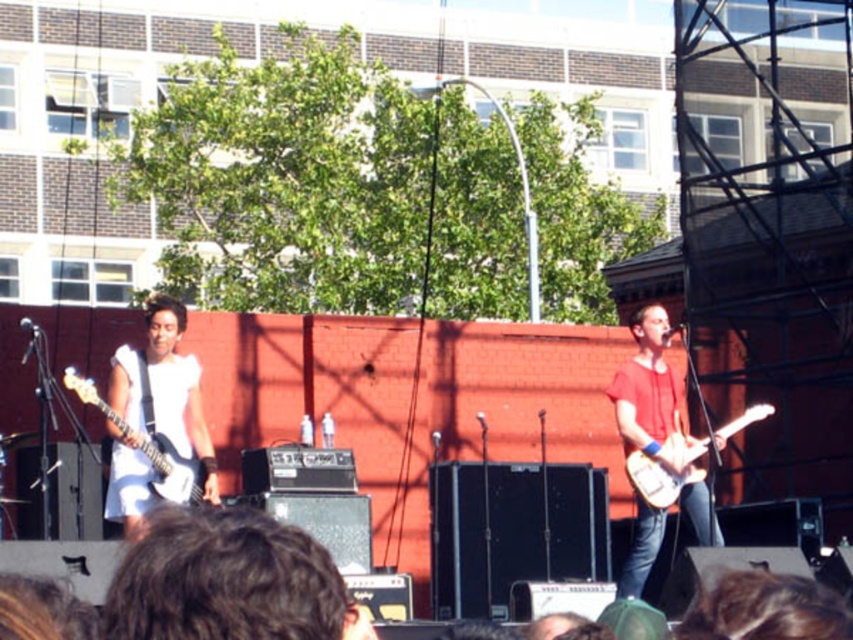
Question: Can you confirm if brown curly hair at lower center is wider than white glossy electric guitar at right?

Choices:
 (A) yes
 (B) no

Answer: (A)

Question: Estimate the real-world distances between objects in this image. Which object is farther from the white matte electric guitar at left?

Choices:
 (A) matte red guitar at right
 (B) white matte guitar at left
 (C) brown curly hair at lower center

Answer: (C)

Question: Is brown curly hair at lower center thinner than white matte guitar at left?

Choices:
 (A) no
 (B) yes

Answer: (A)

Question: Among these objects, which one is farthest from the camera?

Choices:
 (A) matte red guitar at right
 (B) white matte electric guitar at left

Answer: (A)

Question: Which point is closer to the camera?

Choices:
 (A) (640, 493)
 (B) (126, 353)
 (C) (180, 496)

Answer: (C)

Question: Can you confirm if brown curly hair at lower center is positioned below matte red guitar at right?

Choices:
 (A) no
 (B) yes

Answer: (B)